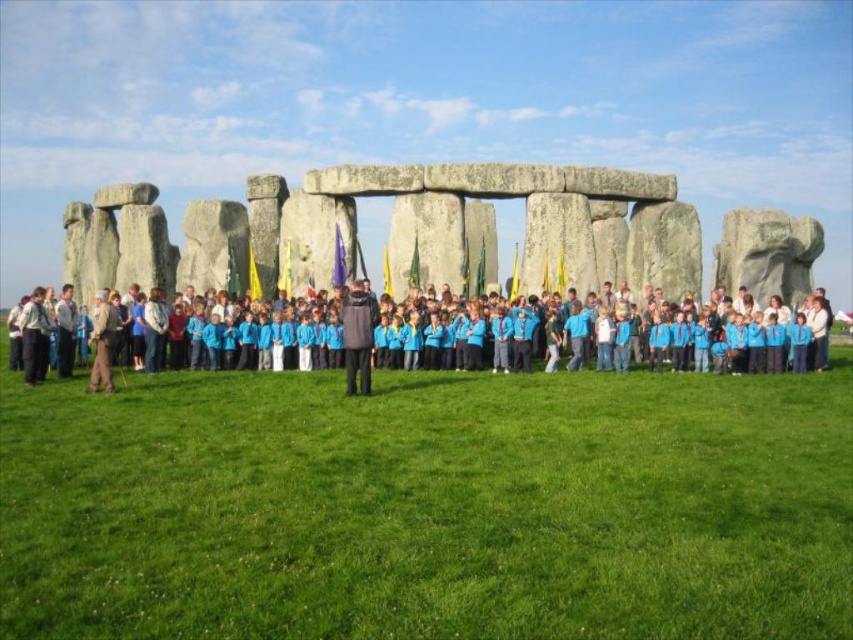
Which is more to the right, green grass at center or blue fabric flag at center?

Positioned to the right is green grass at center.

Is point (234, 580) positioned before point (338, 227)?

That is True.

Is point (299, 589) positioned in front of point (341, 284)?

Yes, point (299, 589) is closer to viewer.

Identify the location of green grass at center. The width and height of the screenshot is (853, 640). (428, 508).

Does point (659, 332) come farther from viewer compared to point (368, 385)?

Yes, it is.

What do you see at coordinates (737, 344) in the screenshot? Image resolution: width=853 pixels, height=640 pixels. I see `blue uniform at center` at bounding box center [737, 344].

This screenshot has height=640, width=853. I want to click on blue uniform at center, so click(x=737, y=344).

Locate an element on the screen. The image size is (853, 640). blue uniform at center is located at coordinates (737, 344).

Does dark gray jacket at center have a lesser height compared to blue fabric flag at center?

No.

Does point (369, 385) lie behind point (344, 278)?

No.

What do you see at coordinates (357, 337) in the screenshot?
I see `dark gray jacket at center` at bounding box center [357, 337].

Image resolution: width=853 pixels, height=640 pixels. Find the location of `dark gray jacket at center`. dark gray jacket at center is located at coordinates (357, 337).